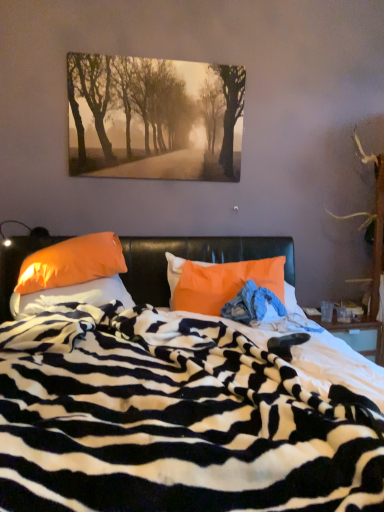
Question: Does point (66, 500) appear closer or farther from the camera than point (120, 74)?

Choices:
 (A) farther
 (B) closer

Answer: (B)

Question: Relative to matte paper print at upper center, is zebra-patterned fabric at center in front or behind?

Choices:
 (A) behind
 (B) front

Answer: (B)

Question: Which is nearer to the orange fabric pillow at left, arranged as the 3th pillow when viewed from the right?

Choices:
 (A) matte paper print at upper center
 (B) orange fabric pillow at center, arranged as the third pillow when viewed from the left
 (C) zebra-patterned fabric at center
 (D) orange fabric pillow at left, acting as the 2th pillow starting from the left
 (E) blue denim jeans at center

Answer: (D)

Question: Considering the real-world distances, which object is closest to the orange fabric pillow at left, arranged as the 3th pillow when viewed from the right?

Choices:
 (A) orange fabric pillow at left, acting as the 2th pillow starting from the left
 (B) zebra-patterned fabric at center
 (C) blue denim jeans at center
 (D) matte paper print at upper center
 (E) orange fabric pillow at center, arranged as the first pillow when viewed from the right

Answer: (A)